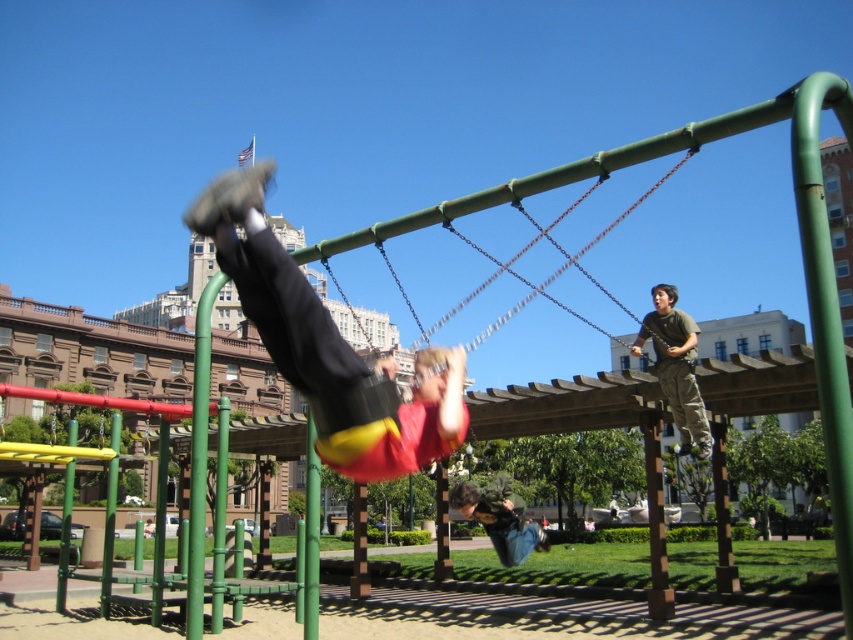
From the picture: Between green camouflage pants at upper right and green matte pole at center, which one has more height?

green camouflage pants at upper right

Between green camouflage pants at upper right and green matte pole at center, which one appears on the right side from the viewer's perspective?

Positioned to the right is green camouflage pants at upper right.

Is point (689, 404) positioned in front of point (309, 586)?

No, (689, 404) is further to viewer.

Locate an element on the screen. This screenshot has width=853, height=640. green camouflage pants at upper right is located at coordinates (676, 368).

Does matte yellow pants at center appear on the right side of denim jeans at lower center?

No, matte yellow pants at center is not to the right of denim jeans at lower center.

Is matte yellow pants at center smaller than denim jeans at lower center?

Actually, matte yellow pants at center might be larger than denim jeans at lower center.

Who is more forward, [305,282] or [498,548]?

Positioned in front is point [305,282].

This screenshot has height=640, width=853. Identify the location of matte yellow pants at center. (328, 346).

The image size is (853, 640). Identify the location of matte yellow pants at center. pos(328,346).

Does point (259, 180) come in front of point (305, 632)?

Yes, it is in front of point (305, 632).

Is point (428, 368) in front of point (311, 436)?

Yes, it is.

Where is `matte yellow pants at center`? This screenshot has width=853, height=640. matte yellow pants at center is located at coordinates (328, 346).